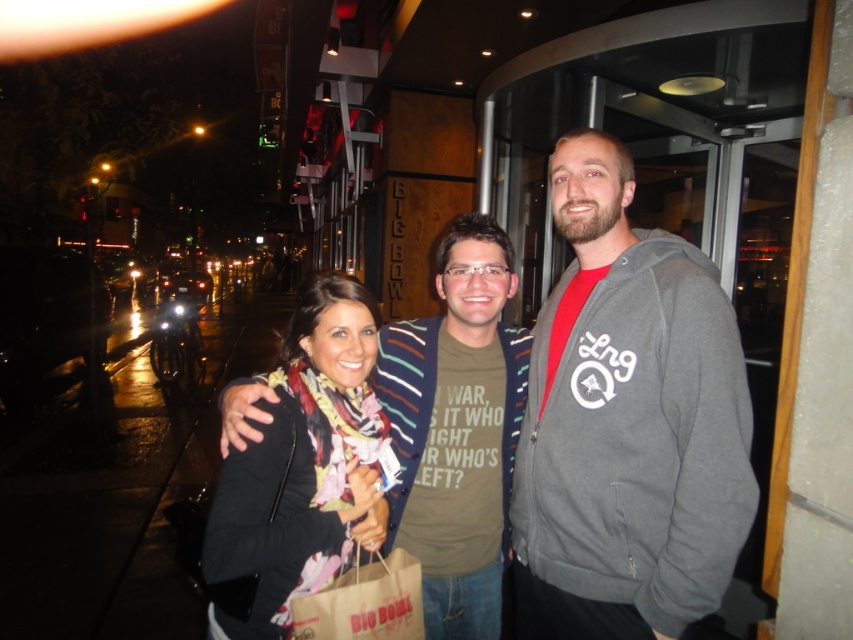
Does matte brown sweater at center have a lesser width compared to black textured scarf at center?

No, matte brown sweater at center is not thinner than black textured scarf at center.

Which of these two, matte brown sweater at center or black textured scarf at center, stands shorter?

black textured scarf at center is shorter.

Is point (508, 268) positioned in front of point (374, 541)?

No, it is not.

Image resolution: width=853 pixels, height=640 pixels. I want to click on matte brown sweater at center, so [x=457, y=429].

Which is above, multicolored scarf at center or black textured scarf at center?

multicolored scarf at center is higher up.

You are a GUI agent. You are given a task and a screenshot of the screen. Output one action in this format:
    pyautogui.click(x=<x>, y=<y>)
    Task: Click on the multicolored scarf at center
    This screenshot has width=853, height=640.
    Given the screenshot: What is the action you would take?
    pyautogui.click(x=628, y=422)

Does gray fleece hoodie at right come behind multicolored scarf at center?

No, gray fleece hoodie at right is in front of multicolored scarf at center.

Does gray fleece hoodie at right have a larger size compared to multicolored scarf at center?

Indeed, gray fleece hoodie at right has a larger size compared to multicolored scarf at center.

Which is in front, point (524, 538) or point (572, 369)?

Point (572, 369) is in front.

Locate an element on the screen. gray fleece hoodie at right is located at coordinates (627, 422).